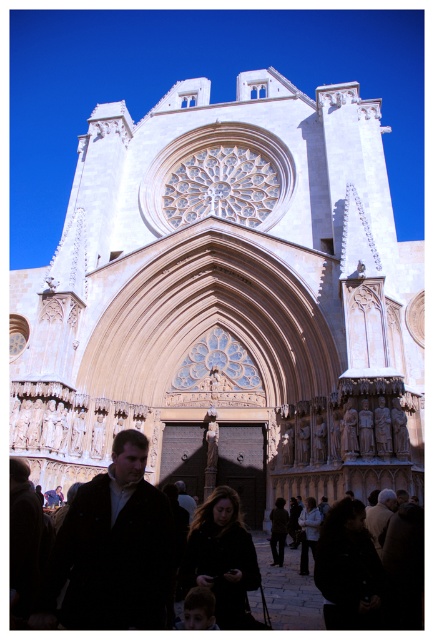
Who is more forward, [265,412] or [111,536]?

Point [111,536] is more forward.

Who is shorter, beige stone church at center or dark brown leather jacket at lower left?

dark brown leather jacket at lower left

Which is in front, point (118, 209) or point (101, 580)?

Positioned in front is point (101, 580).

The image size is (434, 640). I want to click on beige stone church at center, so click(x=227, y=301).

Does point (49, 316) lie behind point (301, 618)?

Yes, point (49, 316) is behind point (301, 618).

In order to click on beige stone church at center in this screenshot , I will do `click(227, 301)`.

You are a GUI agent. You are given a task and a screenshot of the screen. Output one action in this format:
    pyautogui.click(x=<x>, y=<y>)
    Task: Click on the beige stone church at center
    The image size is (434, 640).
    Given the screenshot: What is the action you would take?
    pyautogui.click(x=227, y=301)

Does dark brown leather jacket at lower left appear over black fabric crowd at lower center?

Correct, dark brown leather jacket at lower left is located above black fabric crowd at lower center.

Does dark brown leather jacket at lower left have a greater width compared to black fabric crowd at lower center?

No, dark brown leather jacket at lower left is not wider than black fabric crowd at lower center.

The width and height of the screenshot is (434, 640). Find the location of `dark brown leather jacket at lower left`. dark brown leather jacket at lower left is located at coordinates (117, 547).